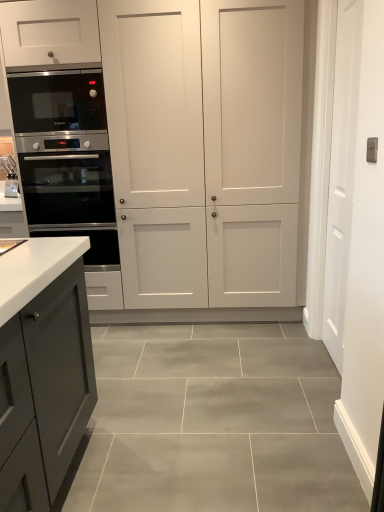
Find the location of a particular element. Image resolution: width=384 pixels, height=512 pixels. white matte cabinet at center is located at coordinates (189, 137).

Find the location of a particular element. This screenshot has height=512, width=384. stainless steel oven at left is located at coordinates (67, 179).

Which object is thinner, white glossy sink at left or black stainless steel microwave at left?

white glossy sink at left.

Is white glossy sink at left positioned far away from black stainless steel microwave at left?

white glossy sink at left is near black stainless steel microwave at left, not far away.

How much distance is there between white glossy sink at left and black stainless steel microwave at left?

white glossy sink at left and black stainless steel microwave at left are 31.27 inches apart from each other.

Between white glossy sink at left and black stainless steel microwave at left, which one has more height?

black stainless steel microwave at left is taller.

Identify the location of sink above the white smooth door at right (from the image's perspective). The height and width of the screenshot is (512, 384). (10, 176).

Is the depth of white glossy sink at left less than that of white smooth door at right?

No, the depth of white glossy sink at left is greater than that of white smooth door at right.

Visually, is white glossy sink at left positioned to the left or to the right of white smooth door at right?

Based on their positions, white glossy sink at left is located to the left of white smooth door at right.

Is white glossy sink at left oriented towards white smooth door at right?

No, white glossy sink at left is not turned towards white smooth door at right.

Are stainless steel oven at left and black stainless steel microwave at left far apart?

That's not correct — stainless steel oven at left is a little close to black stainless steel microwave at left.

Considering the positions of point (94, 155) and point (69, 93), is point (94, 155) closer or farther from the camera than point (69, 93)?

Point (94, 155) is positioned farther from the camera compared to point (69, 93).

Is stainless steel oven at left facing away from black stainless steel microwave at left?

No, black stainless steel microwave at left is not at the back of stainless steel oven at left.

Locate an element on the screen. The image size is (384, 512). microwave oven above the stainless steel oven at left (from the image's perspective) is located at coordinates (57, 101).

You are a GUI agent. You are given a task and a screenshot of the screen. Output one action in this format:
    pyautogui.click(x=<x>, y=<y>)
    Task: Click on the microwave oven on the left of white smooth door at right
    
    Given the screenshot: What is the action you would take?
    pyautogui.click(x=57, y=101)

From the image's perspective, is white smooth door at right under black stainless steel microwave at left?

Yes, from the image's perspective, white smooth door at right is below black stainless steel microwave at left.

Is white smooth door at right at the left side of black stainless steel microwave at left?

Incorrect, white smooth door at right is not on the left side of black stainless steel microwave at left.

Based on the photo, how many degrees apart are the facing directions of black stainless steel microwave at left and stainless steel oven at left?

The angular difference between black stainless steel microwave at left and stainless steel oven at left is 0.000641 degrees.

Is stainless steel oven at left located within black stainless steel microwave at left?

That's incorrect, stainless steel oven at left is not inside black stainless steel microwave at left.

Considering the points (58, 113) and (60, 167), which point is in front, point (58, 113) or point (60, 167)?

Point (58, 113)

I want to click on cupboard below the black stainless steel microwave at left (from a real-world perspective), so click(189, 137).

From the image's perspective, which one is positioned lower, black stainless steel microwave at left or white matte cabinet at center?

Result: From the image's view, white matte cabinet at center is below.

What's the angular difference between black stainless steel microwave at left and white matte cabinet at center's facing directions?

The angle between the facing direction of black stainless steel microwave at left and the facing direction of white matte cabinet at center is 2.1 degrees.

Are black stainless steel microwave at left and white matte cabinet at center located far from each other?

They are positioned close to each other.

Consider the image. Can you confirm if white smooth door at right is thinner than stainless steel oven at left?

Yes.

Considering the relative positions of white smooth door at right and stainless steel oven at left in the image provided, is white smooth door at right to the right of stainless steel oven at left from the viewer's perspective?

Correct, you'll find white smooth door at right to the right of stainless steel oven at left.

Is the surface of white smooth door at right in direct contact with stainless steel oven at left?

They are not placed beside each other.

Is white smooth door at right oriented away from stainless steel oven at left?

No, white smooth door at right is not facing the opposite direction of stainless steel oven at left.

Locate an element on the screen. microwave oven lying in front of the white glossy sink at left is located at coordinates (57, 101).

Where is `sink that is on the left side of white smooth door at right`? sink that is on the left side of white smooth door at right is located at coordinates [10, 176].

In the scene shown: When comparing their distances from white smooth door at right, does white matte cabinet at center or white glossy sink at left seem closer?

Among the two, white matte cabinet at center is located nearer to white smooth door at right.

Based on their spatial positions, is stainless steel oven at left or white glossy sink at left further from black stainless steel microwave at left?

The object further to black stainless steel microwave at left is white glossy sink at left.

Based on the photo, based on their spatial positions, is white matte cabinet at center or white glossy sink at left further from stainless steel oven at left?

The object further to stainless steel oven at left is white glossy sink at left.

Based on their spatial positions, is stainless steel oven at left or white smooth door at right further from white glossy sink at left?

Based on the image, white smooth door at right appears to be further to white glossy sink at left.

Which object lies further to the anchor point white matte cabinet at center, stainless steel oven at left or white glossy sink at left?

Based on the image, white glossy sink at left appears to be further to white matte cabinet at center.

From the image, which object appears to be farther from stainless steel oven at left, white smooth door at right or white glossy sink at left?

white smooth door at right lies further to stainless steel oven at left than the other object.

When comparing their distances from stainless steel oven at left, does black stainless steel microwave at left or white glossy sink at left seem further?

white glossy sink at left is positioned further to the anchor stainless steel oven at left.

When comparing their distances from white smooth door at right, does black stainless steel microwave at left or white matte cabinet at center seem closer?

white matte cabinet at center lies closer to white smooth door at right than the other object.

I want to click on cupboard between white glossy sink at left and white smooth door at right from left to right, so click(x=189, y=137).

Image resolution: width=384 pixels, height=512 pixels. In order to click on oven between white glossy sink at left and white smooth door at right from left to right in this screenshot , I will do [x=67, y=179].

Locate an element on the screen. microwave oven located between white glossy sink at left and white smooth door at right in the left-right direction is located at coordinates (57, 101).

I want to click on cupboard situated between stainless steel oven at left and white smooth door at right from left to right, so click(x=189, y=137).